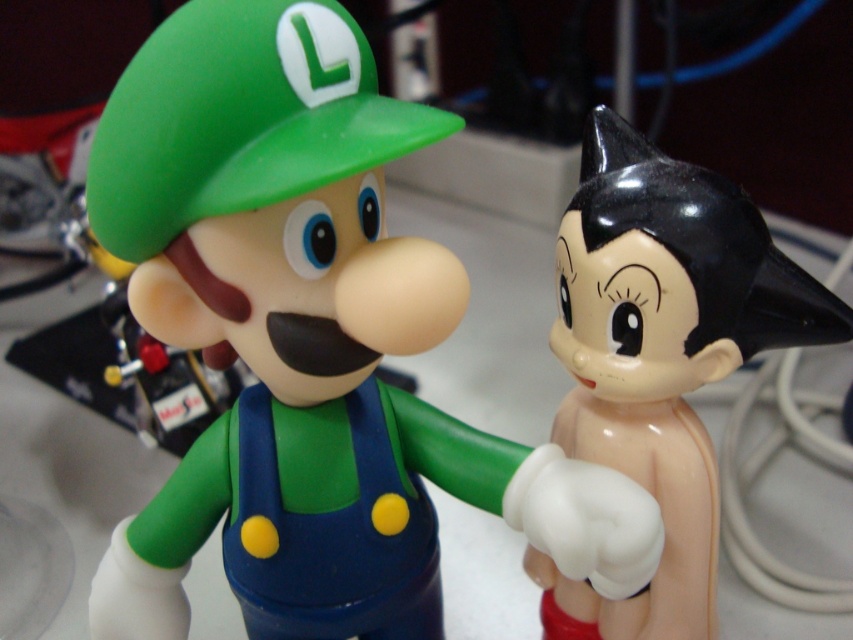
You are a photographer trying to capture a closeup of the figurine on the left. You are currently positioned at the point labeled point [242,72] and point [640,212]. Which point should you stand closer to for the best shot?

You should stand closer to point [242,72] because it is closer to the viewer than point [640,212], allowing for a better closeup of the figurine on the left.